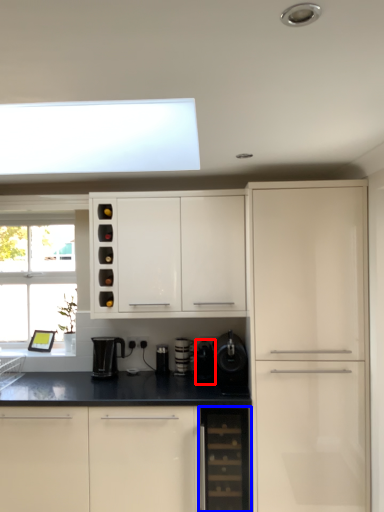
Question: Among these objects, which one is nearest to the camera, appliance (highlighted by a red box) or dish washer (highlighted by a blue box)?

Choices:
 (A) appliance
 (B) dish washer

Answer: (B)